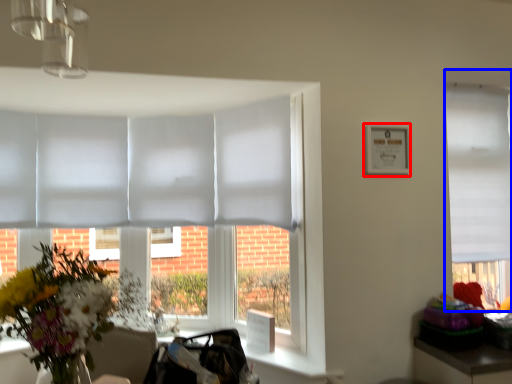
Question: Which point is closer to the camera, picture frame (highlighted by a red box) or window (highlighted by a blue box)?

Choices:
 (A) picture frame
 (B) window

Answer: (A)